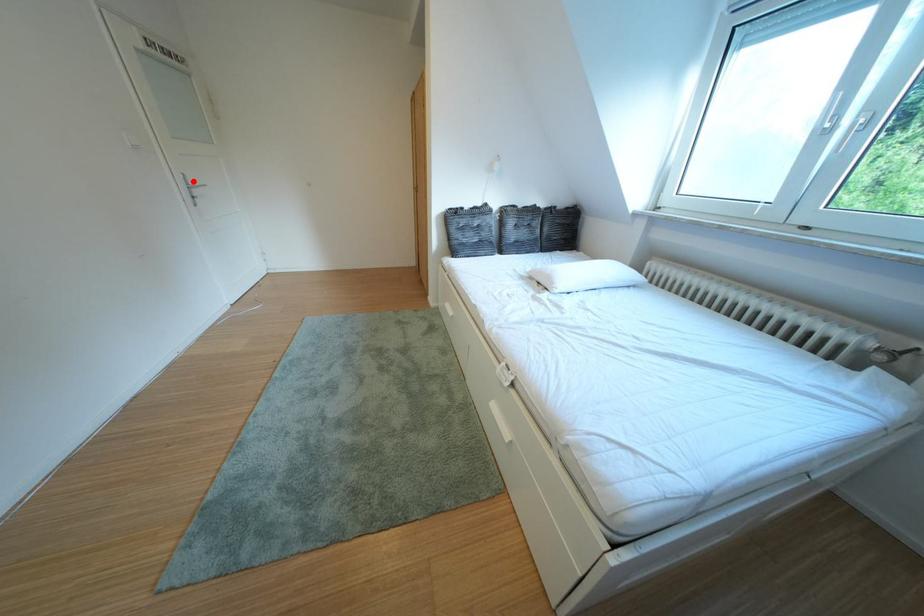
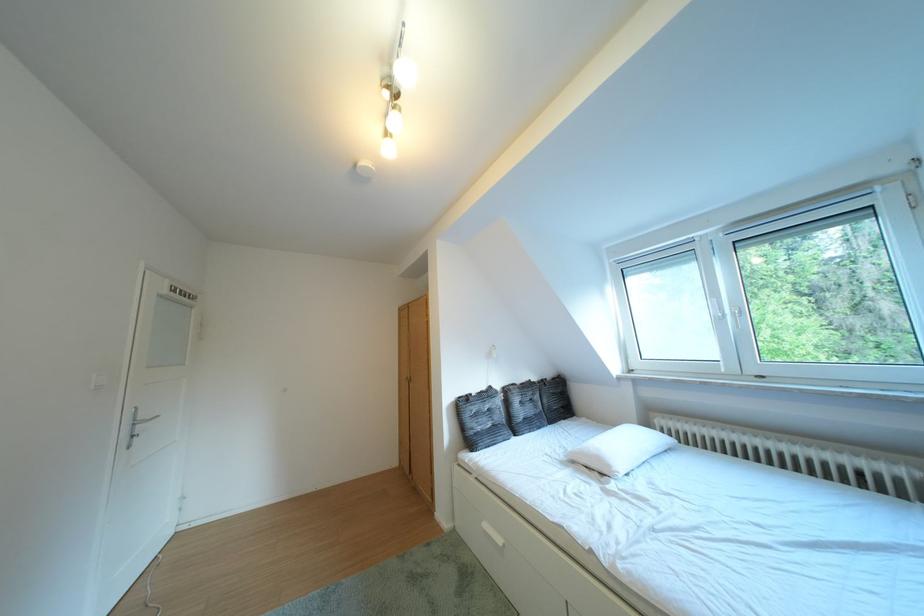
The point at the highlighted location is marked in the first image. Where is the corresponding point in the second image?

(141, 418)